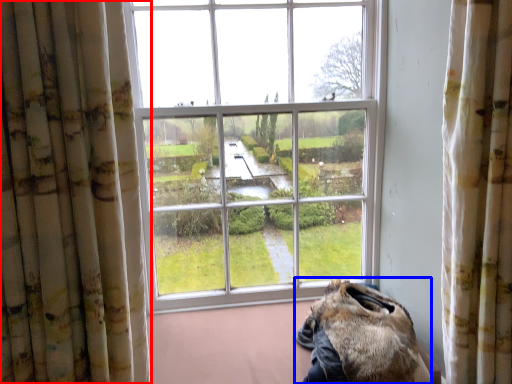
Question: Among these objects, which one is nearest to the camera, curtain (highlighted by a red box) or animal (highlighted by a blue box)?

Choices:
 (A) curtain
 (B) animal

Answer: (A)